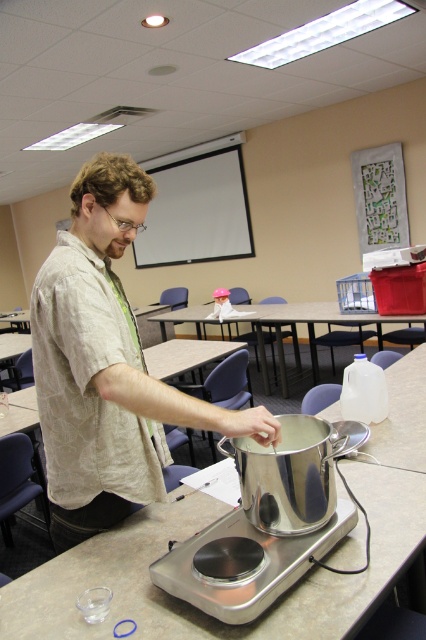
You are a student sitting in the classroom and want to ask the man a question. Which object, the matte beige shirt at center or the metallic table at center, would you approach first if you want to get closer to him?

The matte beige shirt at center is in front of the metallic table at center, so you should approach the matte beige shirt at center first to get closer to him.

You are a visitor in the room and want to know which object is taller between the matte beige shirt at center and the silver metallic table at center. Based on the scene description, can you determine which one is taller?

The matte beige shirt at center is taller than the silver metallic table at center according to the description.